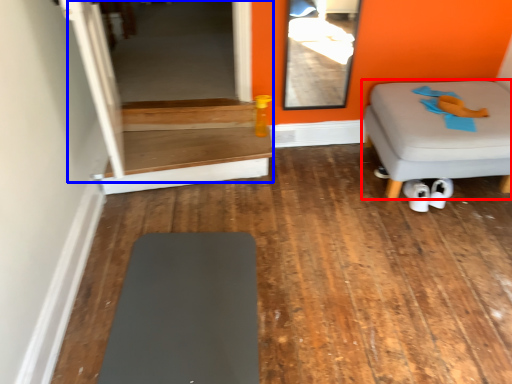
Question: Among these objects, which one is nearest to the camera, furniture (highlighted by a red box) or glass door (highlighted by a blue box)?

Choices:
 (A) furniture
 (B) glass door

Answer: (A)